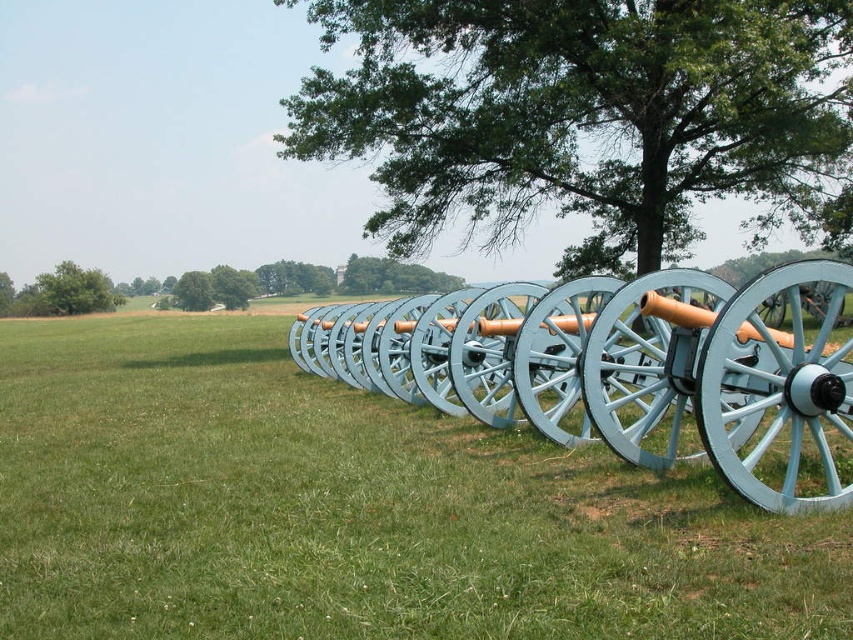
The height and width of the screenshot is (640, 853). Describe the element at coordinates (352, 509) in the screenshot. I see `light blue wood cannon at center` at that location.

Is light blue wood cannon at center closer to camera compared to green leafy tree at upper center?

Yes.

I want to click on light blue wood cannon at center, so click(x=352, y=509).

I want to click on light blue wood cannon at center, so [x=352, y=509].

I want to click on light blue wood cannon at center, so pyautogui.click(x=352, y=509).

Does light blue wood cannon at center have a greater height compared to light blue wooden cannon at center?

Incorrect, light blue wood cannon at center's height is not larger of light blue wooden cannon at center's.

At what (x,y) coordinates should I click in order to perform the action: click on light blue wood cannon at center. Please return your answer as a coordinate pair (x, y). The width and height of the screenshot is (853, 640). Looking at the image, I should click on (352, 509).

The image size is (853, 640). Identify the location of light blue wood cannon at center. (352, 509).

Between light blue wood cannon at center and green leafy tree at upper left, which one is positioned lower?

light blue wood cannon at center is lower down.

Is point (225, 570) closer to viewer compared to point (90, 285)?

Yes, point (225, 570) is in front of point (90, 285).

In order to click on light blue wood cannon at center in this screenshot , I will do `click(352, 509)`.